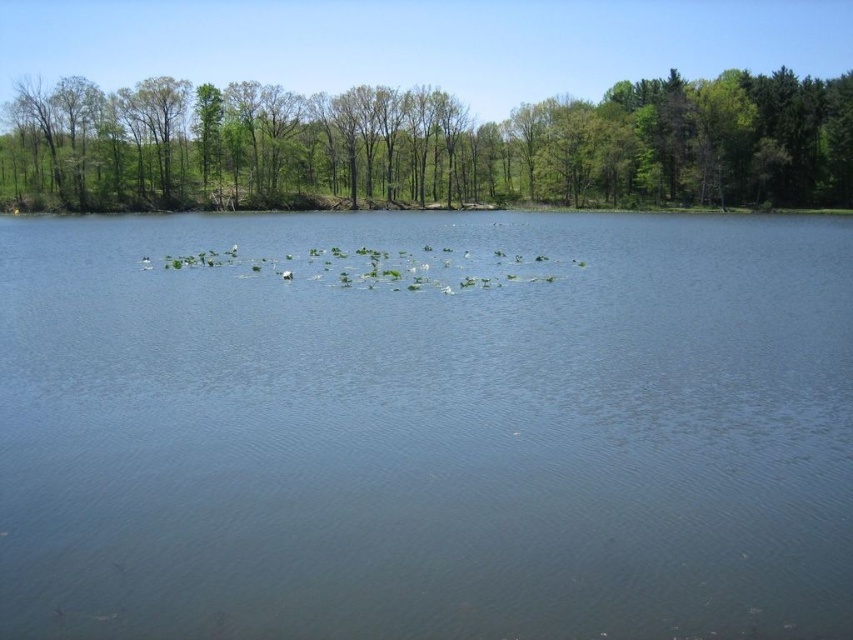
You are standing at the edge of the lake and want to take a photo of the clear blue water at center and the green leafy trees at upper center. Which object will appear larger in your photo?

The clear blue water at center will appear larger in your photo because it is closer to the viewer than the green leafy trees at upper center.

Consider the image. You are standing on the lakeside and want to know which object in the scene is closer to you. Based on the clear blue water at center and the green leafy trees at upper center, which one is nearer?

The clear blue water at center is nearer to you since it is positioned in the foreground of the image, while the green leafy trees at upper center are located in the background and thus farther away.